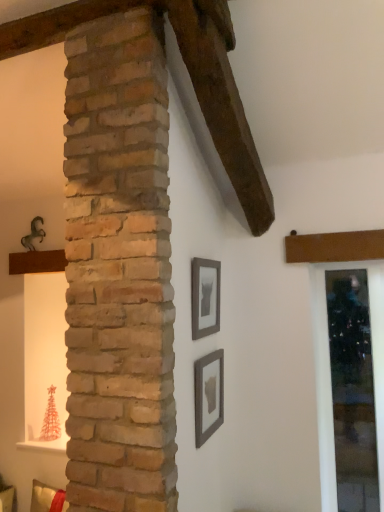
Describe the element at coordinates (330, 373) in the screenshot. I see `clear glass door at right` at that location.

Image resolution: width=384 pixels, height=512 pixels. What do you see at coordinates (209, 395) in the screenshot?
I see `matte gray picture frame at lower center, the second picture frame viewed from the top` at bounding box center [209, 395].

Image resolution: width=384 pixels, height=512 pixels. I want to click on clear glass door at right, so click(330, 373).

This screenshot has width=384, height=512. Find the location of `window frame behind the matte gray picture frame at center, the second picture frame from the bottom`. window frame behind the matte gray picture frame at center, the second picture frame from the bottom is located at coordinates (330, 373).

In the image, is clear glass door at right on the left side or the right side of matte gray picture frame at center, placed as the 1th picture frame when sorted from top to bottom?

From the image, it's evident that clear glass door at right is to the right of matte gray picture frame at center, placed as the 1th picture frame when sorted from top to bottom.

Relative to matte gray picture frame at center, the second picture frame from the bottom, is clear glass door at right in front or behind?

Clearly, clear glass door at right is behind matte gray picture frame at center, the second picture frame from the bottom.

Which is behind, clear glass door at right or matte gray picture frame at lower center, the second picture frame viewed from the top?

clear glass door at right is further away from the camera.

Considering the sizes of objects clear glass door at right and matte gray picture frame at lower center, the second picture frame viewed from the top, in the image provided, who is smaller, clear glass door at right or matte gray picture frame at lower center, the second picture frame viewed from the top,?

matte gray picture frame at lower center, the second picture frame viewed from the top.

From the image's perspective, which object appears higher, clear glass door at right or matte gray picture frame at lower center, the 1th picture frame in the bottom-to-top sequence?

matte gray picture frame at lower center, the 1th picture frame in the bottom-to-top sequence.

Are clear glass door at right and matte gray picture frame at lower center, the second picture frame viewed from the top, located far from each other?

No, clear glass door at right is not far away from matte gray picture frame at lower center, the second picture frame viewed from the top.

Find the location of a particular element. The width and height of the screenshot is (384, 512). window frame below the matte gray picture frame at center, the second picture frame from the bottom (from a real-world perspective) is located at coordinates (330, 373).

Are matte gray picture frame at center, placed as the 1th picture frame when sorted from top to bottom, and clear glass door at right far apart?

matte gray picture frame at center, placed as the 1th picture frame when sorted from top to bottom, is near clear glass door at right, not far away.

From the image's perspective, is matte gray picture frame at center, placed as the 1th picture frame when sorted from top to bottom, over clear glass door at right?

Yes, from the image's perspective, matte gray picture frame at center, placed as the 1th picture frame when sorted from top to bottom, is on top of clear glass door at right.

How different are the orientations of matte gray picture frame at center, the second picture frame from the bottom, and clear glass door at right in degrees?

88 degrees.

Considering the sizes of objects matte gray picture frame at center, the second picture frame from the bottom, and matte gray picture frame at lower center, the second picture frame viewed from the top, in the image provided, who is taller, matte gray picture frame at center, the second picture frame from the bottom, or matte gray picture frame at lower center, the second picture frame viewed from the top,?

matte gray picture frame at center, the second picture frame from the bottom, is taller.

Looking at this image, considering the sizes of matte gray picture frame at center, placed as the 1th picture frame when sorted from top to bottom, and matte gray picture frame at lower center, the second picture frame viewed from the top, in the image, is matte gray picture frame at center, placed as the 1th picture frame when sorted from top to bottom, wider or thinner than matte gray picture frame at lower center, the second picture frame viewed from the top,?

In the image, matte gray picture frame at center, placed as the 1th picture frame when sorted from top to bottom, appears to be more narrow than matte gray picture frame at lower center, the second picture frame viewed from the top.

Consider the image. Is matte gray picture frame at center, placed as the 1th picture frame when sorted from top to bottom, smaller than matte gray picture frame at lower center, the 1th picture frame in the bottom-to-top sequence?

Incorrect, matte gray picture frame at center, placed as the 1th picture frame when sorted from top to bottom, is not smaller in size than matte gray picture frame at lower center, the 1th picture frame in the bottom-to-top sequence.

Considering the positions of point (218, 402) and point (330, 494), is point (218, 402) closer or farther from the camera than point (330, 494)?

Clearly, point (218, 402) is closer to the camera than point (330, 494).

Considering the sizes of matte gray picture frame at lower center, the 1th picture frame in the bottom-to-top sequence, and clear glass door at right in the image, is matte gray picture frame at lower center, the 1th picture frame in the bottom-to-top sequence, wider or thinner than clear glass door at right?

matte gray picture frame at lower center, the 1th picture frame in the bottom-to-top sequence, is thinner than clear glass door at right.

Is matte gray picture frame at lower center, the 1th picture frame in the bottom-to-top sequence, positioned with its back to clear glass door at right?

No, matte gray picture frame at lower center, the 1th picture frame in the bottom-to-top sequence, is not facing the opposite direction of clear glass door at right.

At what (x,y) coordinates should I click in order to perform the action: click on the 1st picture frame to the left when counting from the clear glass door at right. Please return your answer as a coordinate pair (x, y). The height and width of the screenshot is (512, 384). Looking at the image, I should click on (209, 395).

In terms of size, does matte gray picture frame at lower center, the 1th picture frame in the bottom-to-top sequence, appear bigger or smaller than matte gray picture frame at center, the second picture frame from the bottom?

In the image, matte gray picture frame at lower center, the 1th picture frame in the bottom-to-top sequence, appears to be smaller than matte gray picture frame at center, the second picture frame from the bottom.

Looking at this image, is matte gray picture frame at lower center, the 1th picture frame in the bottom-to-top sequence, shorter than matte gray picture frame at center, placed as the 1th picture frame when sorted from top to bottom?

Indeed, matte gray picture frame at lower center, the 1th picture frame in the bottom-to-top sequence, has a lesser height compared to matte gray picture frame at center, placed as the 1th picture frame when sorted from top to bottom.

Is matte gray picture frame at lower center, the second picture frame viewed from the top, positioned before matte gray picture frame at center, placed as the 1th picture frame when sorted from top to bottom?

That is True.

Locate an element on the screen. The image size is (384, 512). picture frame behind the matte gray picture frame at lower center, the second picture frame viewed from the top is located at coordinates (205, 297).

Locate an element on the screen. window frame on the right of the matte gray picture frame at center, the second picture frame from the bottom is located at coordinates (330, 373).

This screenshot has width=384, height=512. In order to click on the 1st picture frame above the clear glass door at right (from a real-world perspective) in this screenshot , I will do pyautogui.click(x=209, y=395).

Based on their spatial positions, is matte gray picture frame at lower center, the 1th picture frame in the bottom-to-top sequence, or matte gray picture frame at center, placed as the 1th picture frame when sorted from top to bottom, further from clear glass door at right?

Based on the image, matte gray picture frame at center, placed as the 1th picture frame when sorted from top to bottom, appears to be further to clear glass door at right.

Which object lies further to the anchor point matte gray picture frame at center, placed as the 1th picture frame when sorted from top to bottom, clear glass door at right or matte gray picture frame at lower center, the 1th picture frame in the bottom-to-top sequence?

Among the two, clear glass door at right is located further to matte gray picture frame at center, placed as the 1th picture frame when sorted from top to bottom.

Considering their positions, is matte gray picture frame at lower center, the second picture frame viewed from the top, positioned closer to matte gray picture frame at center, placed as the 1th picture frame when sorted from top to bottom, than clear glass door at right?

Among the two, matte gray picture frame at lower center, the second picture frame viewed from the top, is located nearer to matte gray picture frame at center, placed as the 1th picture frame when sorted from top to bottom.

Estimate the real-world distances between objects in this image. Which object is closer to clear glass door at right, matte gray picture frame at center, placed as the 1th picture frame when sorted from top to bottom, or matte gray picture frame at lower center, the 1th picture frame in the bottom-to-top sequence?

Among the two, matte gray picture frame at lower center, the 1th picture frame in the bottom-to-top sequence, is located nearer to clear glass door at right.

Based on their spatial positions, is clear glass door at right or matte gray picture frame at center, the second picture frame from the bottom, further from matte gray picture frame at lower center, the second picture frame viewed from the top?

clear glass door at right is positioned further to the anchor matte gray picture frame at lower center, the second picture frame viewed from the top.

Based on the photo, considering their positions, is matte gray picture frame at center, placed as the 1th picture frame when sorted from top to bottom, positioned closer to matte gray picture frame at lower center, the 1th picture frame in the bottom-to-top sequence, than clear glass door at right?

Among the two, matte gray picture frame at center, placed as the 1th picture frame when sorted from top to bottom, is located nearer to matte gray picture frame at lower center, the 1th picture frame in the bottom-to-top sequence.

The width and height of the screenshot is (384, 512). I want to click on picture frame between matte gray picture frame at center, placed as the 1th picture frame when sorted from top to bottom, and clear glass door at right, so click(209, 395).